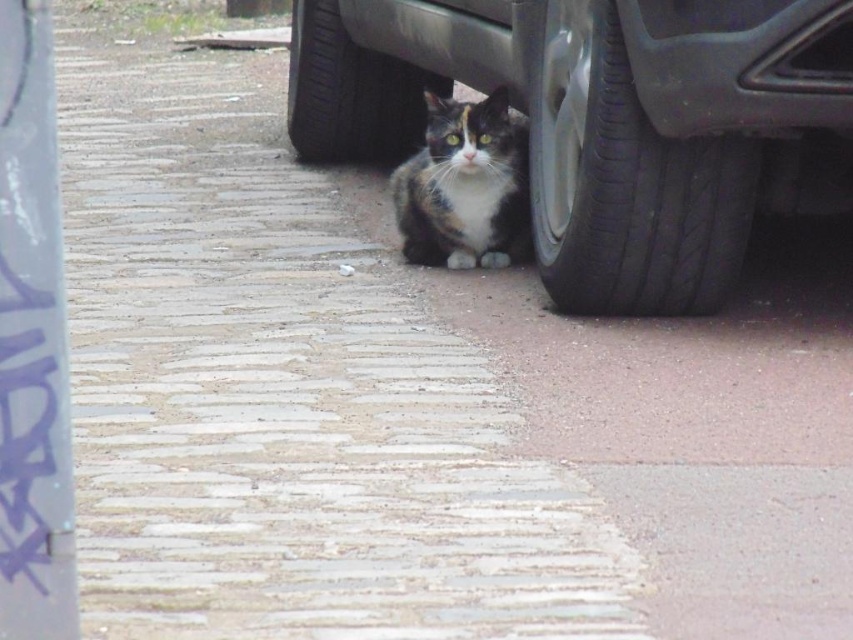
Which is below, metallic gray car at lower center or calico fur cat at center?

calico fur cat at center

Does point (399, 8) come behind point (431, 150)?

That is True.

I want to click on metallic gray car at lower center, so click(605, 122).

You are a GUI agent. You are given a task and a screenshot of the screen. Output one action in this format:
    pyautogui.click(x=<x>, y=<y>)
    Task: Click on the black rubber tire at lower right
    The height and width of the screenshot is (640, 853).
    Given the screenshot: What is the action you would take?
    pyautogui.click(x=625, y=182)

Who is more forward, (561, 264) or (355, 67)?

Point (561, 264)

Which is in front, point (576, 38) or point (361, 134)?

Point (576, 38) is more forward.

You are a GUI agent. You are given a task and a screenshot of the screen. Output one action in this format:
    pyautogui.click(x=<x>, y=<y>)
    Task: Click on the black rubber tire at lower right
    
    Given the screenshot: What is the action you would take?
    pyautogui.click(x=625, y=182)

Is metallic gray car at lower center closer to the viewer compared to black rubber tire at lower center?

That is True.

Can you confirm if metallic gray car at lower center is wider than black rubber tire at lower center?

Yes.

Does point (833, 4) lie behind point (300, 144)?

That is False.

You are a GUI agent. You are given a task and a screenshot of the screen. Output one action in this format:
    pyautogui.click(x=<x>, y=<y>)
    Task: Click on the metallic gray car at lower center
    
    Given the screenshot: What is the action you would take?
    pyautogui.click(x=605, y=122)